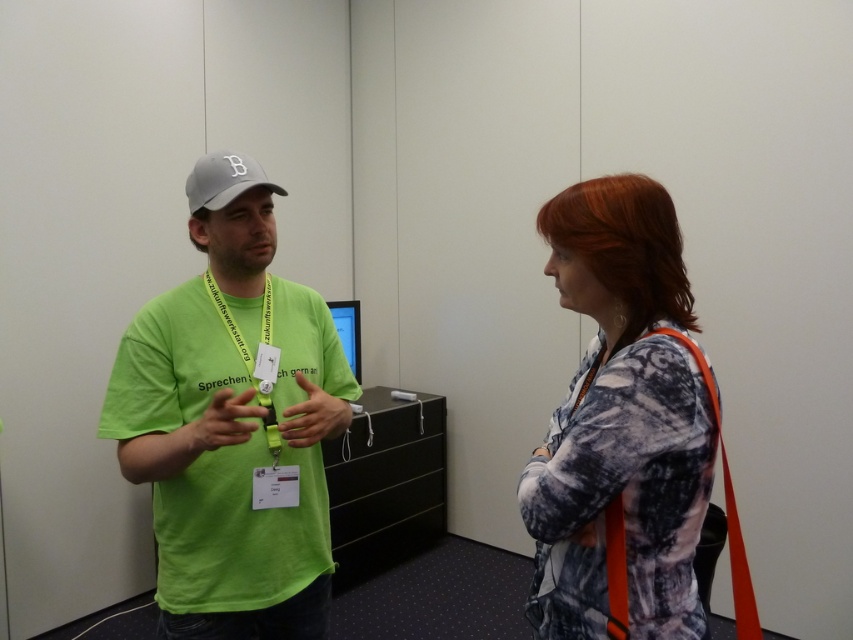
You are a photographer trying to capture a candid shot of both the patterned fabric blouse at right and the gray fabric baseball cap at upper left in the same frame. Which object should you focus on first to ensure both are in sharp focus?

You should focus on the gray fabric baseball cap at upper left first because it is farther away from the viewer than the patterned fabric blouse at right, ensuring both will be in focus when using a camera with a fixed focal plane.

You are organizing a photo shoot and need to ensure that the patterned fabric blouse at right and the gray fabric baseball cap at upper left are visible in the frame. Based on their sizes, which object should you prioritize positioning closer to the camera to maintain clarity?

The patterned fabric blouse at right is wider than the gray fabric baseball cap at upper left, so you should prioritize positioning the patterned fabric blouse at right closer to the camera to maintain clarity.